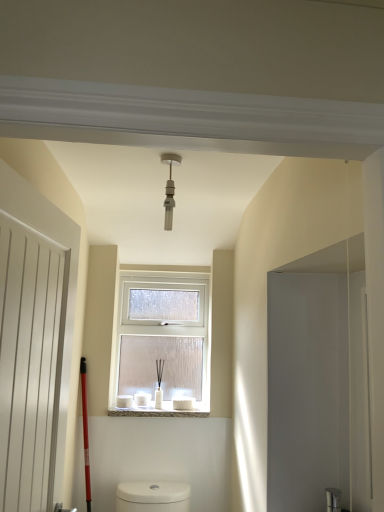
Question: Considering the relative sizes of matte silver light fixture at center and white frosted glass window at center in the image provided, is matte silver light fixture at center thinner than white frosted glass window at center?

Choices:
 (A) no
 (B) yes

Answer: (B)

Question: Does matte silver light fixture at center have a smaller size compared to white frosted glass window at center?

Choices:
 (A) yes
 (B) no

Answer: (A)

Question: Is matte silver light fixture at center looking in the opposite direction of white frosted glass window at center?

Choices:
 (A) no
 (B) yes

Answer: (B)

Question: Is matte silver light fixture at center positioned beyond the bounds of white frosted glass window at center?

Choices:
 (A) yes
 (B) no

Answer: (A)

Question: Could you tell me if matte silver light fixture at center is facing white frosted glass window at center?

Choices:
 (A) yes
 (B) no

Answer: (B)

Question: Are matte silver light fixture at center and white frosted glass window at center located far from each other?

Choices:
 (A) no
 (B) yes

Answer: (B)

Question: Is matte silver light fixture at center not within white matte door at left?

Choices:
 (A) no
 (B) yes

Answer: (B)

Question: Can white matte door at left be found inside matte silver light fixture at center?

Choices:
 (A) yes
 (B) no

Answer: (B)

Question: Considering the relative sizes of matte silver light fixture at center and white matte door at left in the image provided, is matte silver light fixture at center bigger than white matte door at left?

Choices:
 (A) yes
 (B) no

Answer: (B)

Question: Is matte silver light fixture at center oriented towards white matte door at left?

Choices:
 (A) yes
 (B) no

Answer: (B)

Question: Is matte silver light fixture at center closer to the viewer compared to white matte door at left?

Choices:
 (A) no
 (B) yes

Answer: (A)

Question: Can you confirm if matte silver light fixture at center is wider than white matte door at left?

Choices:
 (A) no
 (B) yes

Answer: (B)

Question: Does white frosted glass window at center turn towards white matte door at left?

Choices:
 (A) yes
 (B) no

Answer: (A)